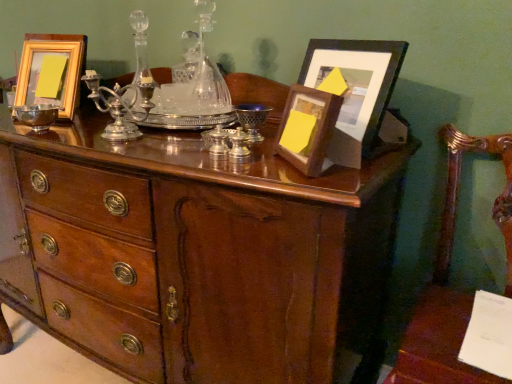
Identify the location of vacant area located to the right-hand side of shiny silver bowl at left. (74, 134).